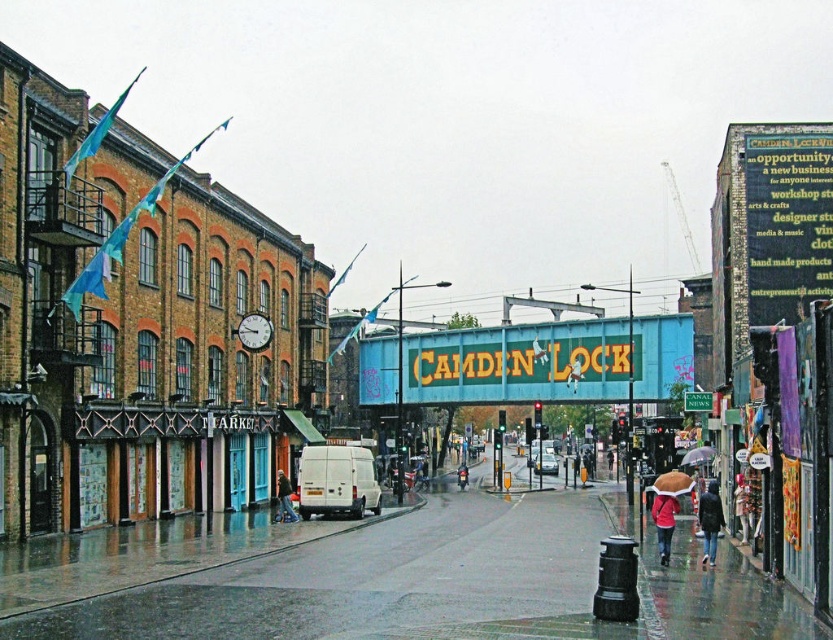
Who is positioned more to the right, teal painted metal signboard at center or denim jacket at lower left?

teal painted metal signboard at center is more to the right.

Is point (390, 376) closer to viewer compared to point (282, 504)?

No, it is not.

Locate an element on the screen. The image size is (833, 640). teal painted metal signboard at center is located at coordinates (549, 362).

Is point (233, 536) positioned before point (377, 337)?

Yes, point (233, 536) is closer to viewer.

Can you confirm if glossy concrete pavement at lower center is positioned to the left of teal painted metal signboard at center?

Correct, you'll find glossy concrete pavement at lower center to the left of teal painted metal signboard at center.

Which is behind, point (671, 618) or point (392, 387)?

Positioned behind is point (392, 387).

At what (x,y) coordinates should I click in order to perform the action: click on glossy concrete pavement at lower center. Please return your answer as a coordinate pair (x, y). The image size is (833, 640). Looking at the image, I should click on (383, 577).

Is the position of glossy concrete pavement at lower center more distant than that of dark gray fabric umbrella at lower right?

No, it is not.

Between glossy concrete pavement at lower center and dark gray fabric umbrella at lower right, which one appears on the left side from the viewer's perspective?

glossy concrete pavement at lower center is more to the left.

Is point (158, 580) closer to camera compared to point (712, 538)?

Yes.

Where is `glossy concrete pavement at lower center`? glossy concrete pavement at lower center is located at coordinates (383, 577).